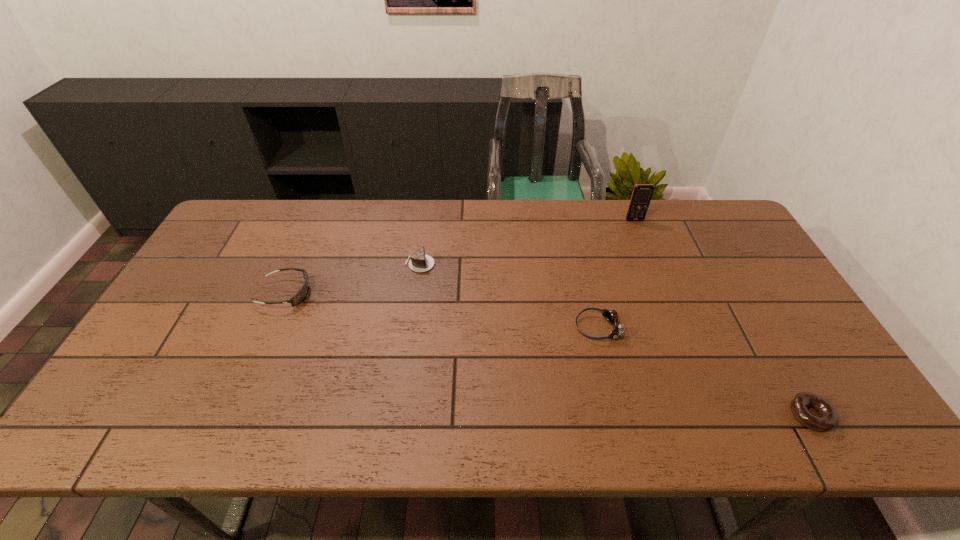
I want to click on object situated at the near right corner, so click(x=828, y=419).

At what (x,y) coordinates should I click in order to perform the action: click on vacant region at the far edge. Please return your answer as a coordinate pair (x, y). Image resolution: width=960 pixels, height=540 pixels. Looking at the image, I should click on (381, 235).

In the image, there is a desktop. Where is `free space at the left edge`? free space at the left edge is located at coordinates (123, 389).

In the image, there is a desktop. At what (x,y) coordinates should I click in order to perform the action: click on vacant space at the right edge. Please return your answer as a coordinate pair (x, y). Looking at the image, I should click on (745, 285).

The image size is (960, 540). I want to click on free space at the far left corner, so click(251, 204).

In the image, there is a desktop. Where is `free region at the near left corner`? This screenshot has width=960, height=540. free region at the near left corner is located at coordinates (89, 430).

Identify the location of vacant space at the far right corner. The height and width of the screenshot is (540, 960). (717, 226).

Identify the location of free space between the leftmost object and the doughnut. (548, 354).

The image size is (960, 540). I want to click on vacant space that's between the right goggles and the rightmost object, so click(x=704, y=371).

Find the location of a particular element. This screenshot has height=540, width=960. free spot between the cellular telephone and the chocolate cake is located at coordinates (527, 242).